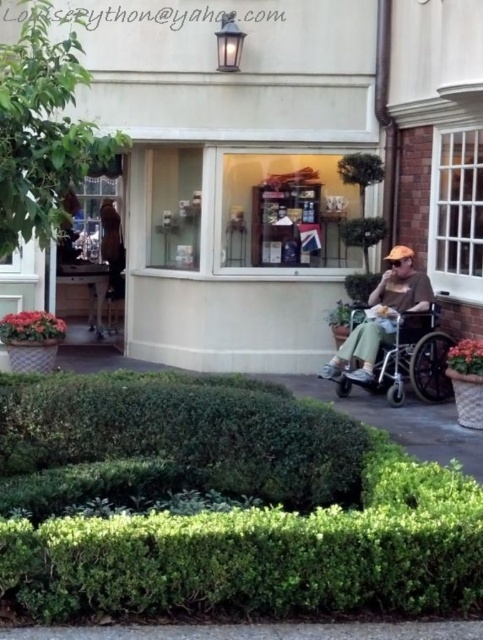
Between green leafy hedge at center and matte brown shirt at right, which one is positioned lower?

green leafy hedge at center

Can you confirm if green leafy hedge at center is positioned to the right of matte brown shirt at right?

No, green leafy hedge at center is not to the right of matte brown shirt at right.

Find the location of a particular element. green leafy hedge at center is located at coordinates (185, 433).

Is silver metallic wheelchair at right smaller than matte brown shirt at right?

Correct, silver metallic wheelchair at right occupies less space than matte brown shirt at right.

Between point (397, 369) and point (397, 289), which one is positioned behind?

The point (397, 289) is behind.

Who is more forward, (421, 336) or (395, 296)?

Point (421, 336) is in front.

Find the location of `silver metallic wheelchair at right`. silver metallic wheelchair at right is located at coordinates (406, 360).

The width and height of the screenshot is (483, 640). Describe the element at coordinates (229, 513) in the screenshot. I see `green leafy hedge at lower center` at that location.

Does point (303, 536) come in front of point (429, 360)?

Yes.

The height and width of the screenshot is (640, 483). What are the coordinates of `green leafy hedge at lower center` in the screenshot? It's located at (229, 513).

At what (x,y) coordinates should I click in order to perform the action: click on green leafy hedge at lower center. Please return your answer as a coordinate pair (x, y). The width and height of the screenshot is (483, 640). Looking at the image, I should click on (229, 513).